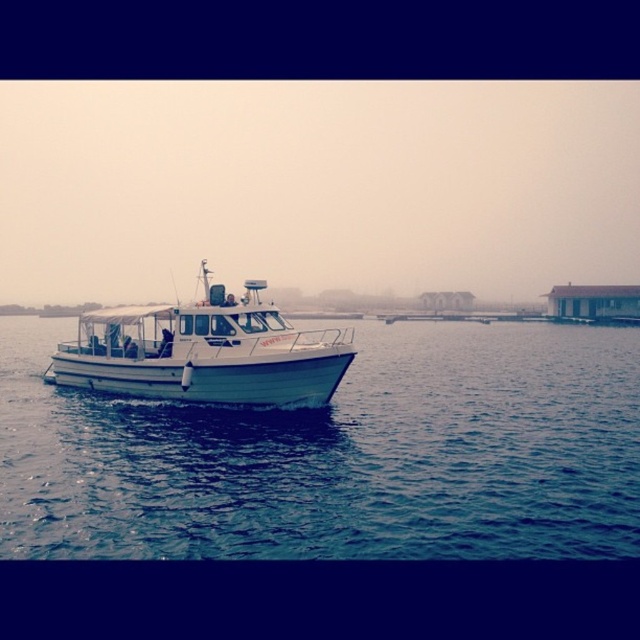
You are standing on the deck of the motorboat and notice two points in the water. The first point is at coordinates point (499,368) and the second is at point (320,355). Which point is closer to you?

Point (499,368) is further to the viewer than point (320,355), so the point closer to you is point (320,355).

You are a passenger on the white matte boat at center and want to know where the blue water at center is located relative to your position. Can you describe its position?

The blue water at center is positioned under the white matte boat at center, so it is directly beneath the boat.